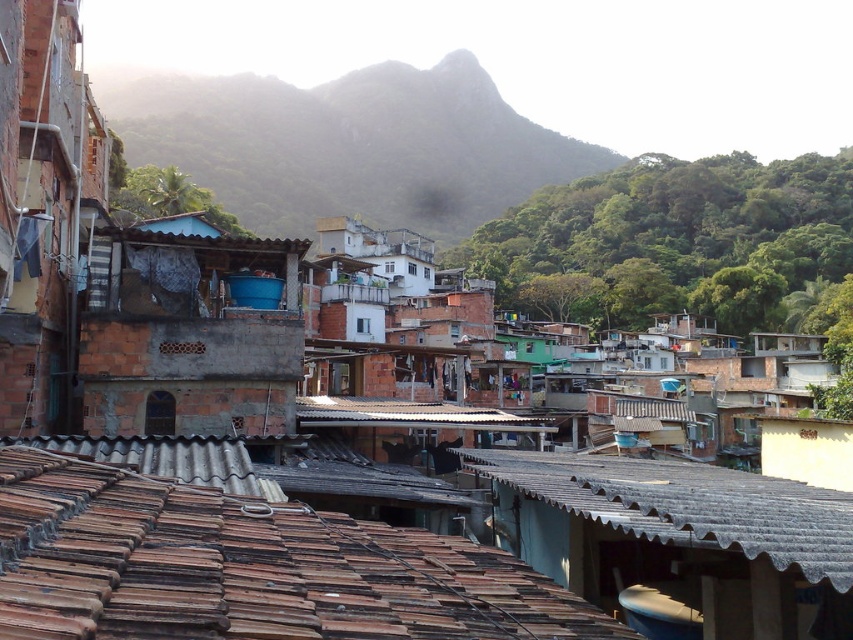
Question: Does green leafy hillside at upper center appear over rusty brick hut at center-left?

Choices:
 (A) yes
 (B) no

Answer: (A)

Question: Is brown tile roof at lower center closer to the viewer compared to rusty brick hut at center-left?

Choices:
 (A) yes
 (B) no

Answer: (A)

Question: Which point is closer to the camera taking this photo?

Choices:
 (A) (724, 493)
 (B) (291, 184)
 (C) (112, 400)

Answer: (A)

Question: Which is farther from the rusty brick hut at center-left?

Choices:
 (A) green leafy hillside at upper center
 (B) rusty corrugated metal roof at center

Answer: (A)

Question: In this image, where is green leafy hillside at upper center located relative to rusty brick hut at center-left?

Choices:
 (A) above
 (B) below

Answer: (A)

Question: Which point is closer to the camera taking this photo?

Choices:
 (A) (247, 273)
 (B) (447, 557)
 (C) (410, 83)
 (D) (691, 476)

Answer: (B)